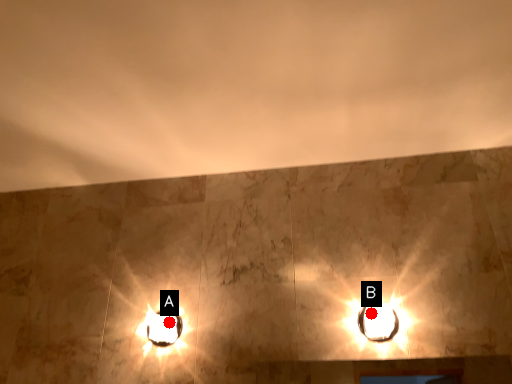
Question: Two points are circled on the image, labeled by A and B beside each circle. Which point is further to the camera?

Choices:
 (A) A is further
 (B) B is further

Answer: (A)